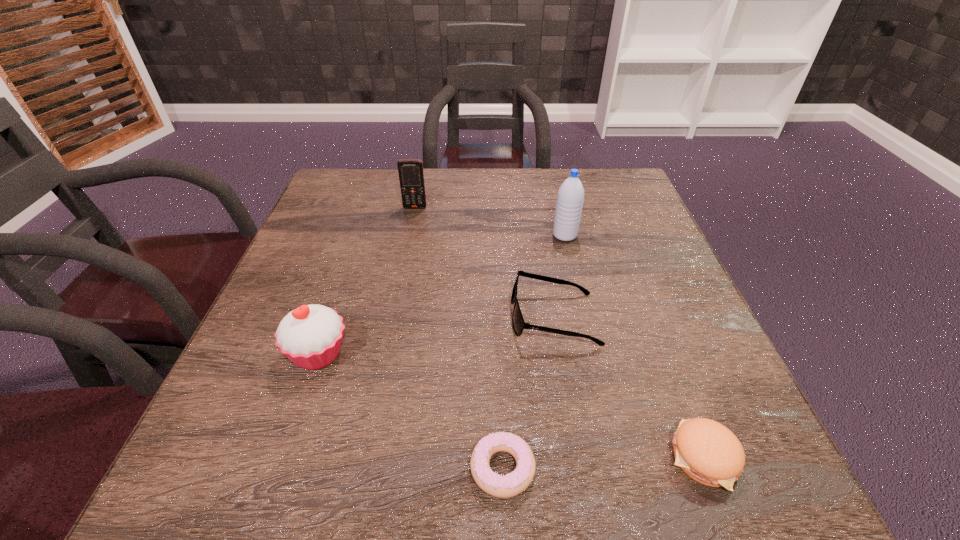
You are a GUI agent. You are given a task and a screenshot of the screen. Output one action in this format:
    pyautogui.click(x=<x>, y=<y>)
    Task: Click on the free space located on the left of the fifth nearest object
    
    Given the screenshot: What is the action you would take?
    pyautogui.click(x=491, y=235)

Locate an element on the screen. free region located 0.190m on the screen of the cellular telephone is located at coordinates (406, 255).

Where is `vacant space located on the back of the third tallest object`? The height and width of the screenshot is (540, 960). vacant space located on the back of the third tallest object is located at coordinates (357, 241).

Find the location of a particular element. This screenshot has width=960, height=540. free point located 0.330m on the front-facing side of the sunglasses is located at coordinates coord(344,318).

Image resolution: width=960 pixels, height=540 pixels. Identify the location of free spot located on the front-facing side of the sunglasses. (395, 318).

At what (x,y) coordinates should I click in order to perform the action: click on free space located 0.340m on the front-facing side of the sunglasses. Please return your answer as a coordinate pair (x, y). Image resolution: width=960 pixels, height=540 pixels. Looking at the image, I should click on (339, 318).

The image size is (960, 540). What are the coordinates of `vacant space positioned on the left of the rightmost object` in the screenshot? It's located at (473, 458).

Find the location of `vacant area situated 0.140m on the back of the doughnut`. vacant area situated 0.140m on the back of the doughnut is located at coordinates (498, 364).

I want to click on object that is at the far edge, so click(x=411, y=176).

The image size is (960, 540). What are the coordinates of `patty located at the near edge` in the screenshot? It's located at (707, 451).